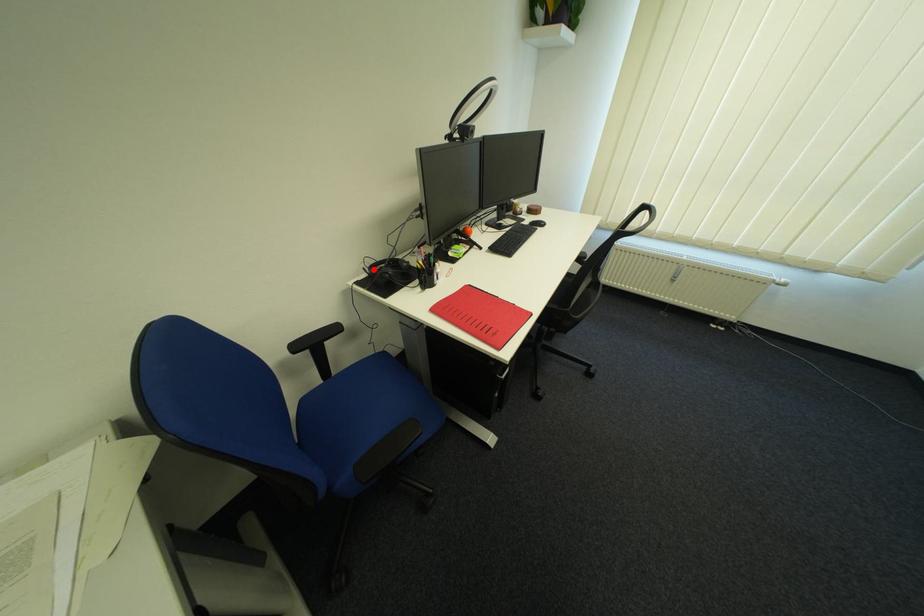
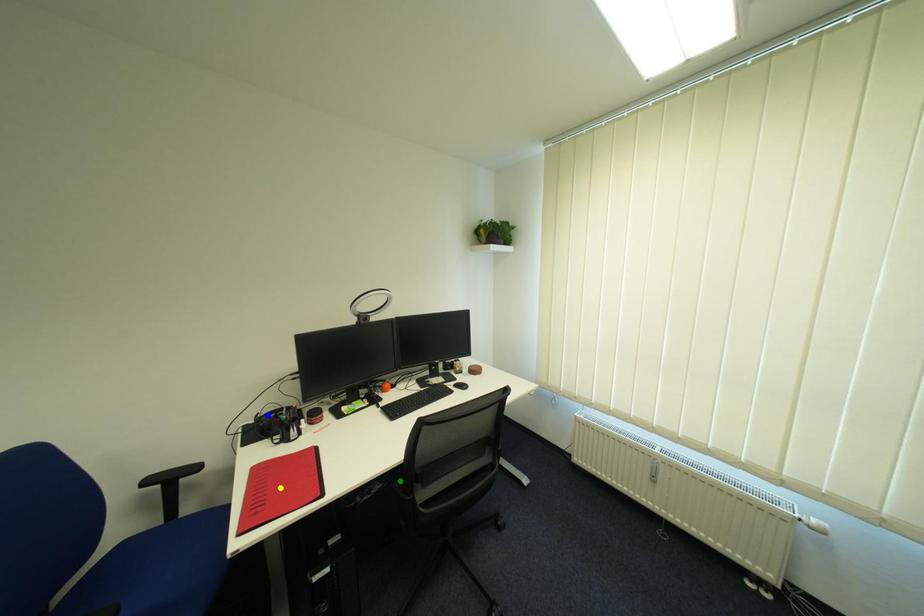
Question: I am providing you with two images of the same scene from different viewpoints. A red point is marked on the first image. You are given multiple points on the second image. Which point in image 2 is actually the same real-world point as the red point in image 1?

Choices:
 (A) green point
 (B) yellow point
 (C) blue point

Answer: (C)